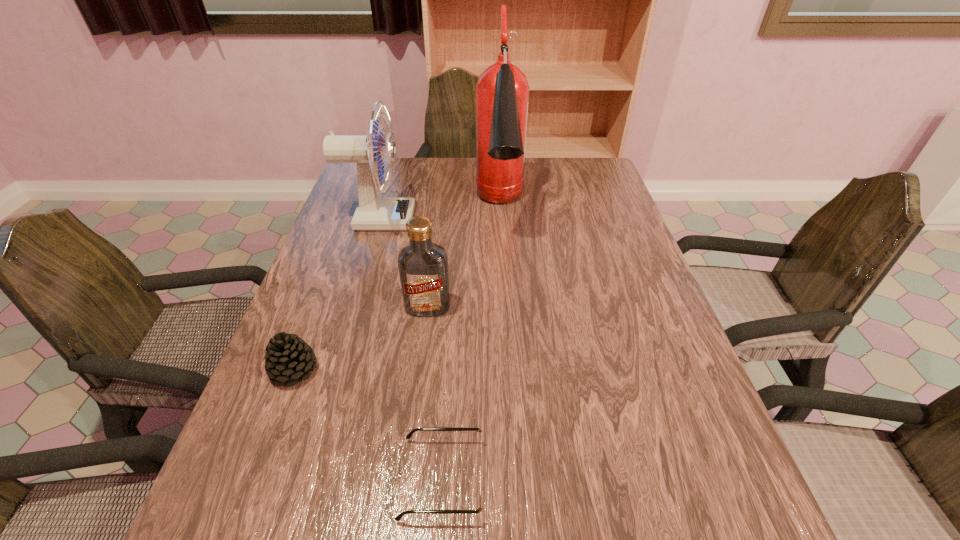
This screenshot has width=960, height=540. In order to click on vacant space situated on the front-facing side of the third tallest object in this screenshot , I will do (x=415, y=412).

Image resolution: width=960 pixels, height=540 pixels. What are the coordinates of `free space located 0.190m at the narrow end of the fourth farthest object` in the screenshot? It's located at (411, 370).

Locate an element on the screen. The width and height of the screenshot is (960, 540). vacant area situated 0.220m at the hinge ends of the spectacles is located at coordinates (618, 478).

At what (x,y) coordinates should I click in order to perform the action: click on object that is positioned at the far edge. Please return your answer as a coordinate pair (x, y). The image size is (960, 540). Looking at the image, I should click on (502, 91).

Where is `fan that is at the left edge`? This screenshot has height=540, width=960. fan that is at the left edge is located at coordinates (373, 213).

Image resolution: width=960 pixels, height=540 pixels. What are the coordinates of `pinecone that is at the left edge` in the screenshot? It's located at (287, 358).

You are a GUI agent. You are given a task and a screenshot of the screen. Output one action in this format:
    pyautogui.click(x=<x>, y=<y>)
    Task: Click on the vacant space at the far edge of the desktop
    The width and height of the screenshot is (960, 540).
    Given the screenshot: What is the action you would take?
    pyautogui.click(x=404, y=194)

Identify the location of vacant area at the left edge. (344, 269).

This screenshot has width=960, height=540. Find the location of `vacant space at the right edge`. vacant space at the right edge is located at coordinates (660, 392).

You are a GUI agent. You are given a task and a screenshot of the screen. Output one action in this format:
    pyautogui.click(x=<x>, y=<y>)
    Task: Click on the free point at the far right corner
    The width and height of the screenshot is (960, 540).
    Given the screenshot: What is the action you would take?
    pyautogui.click(x=599, y=188)